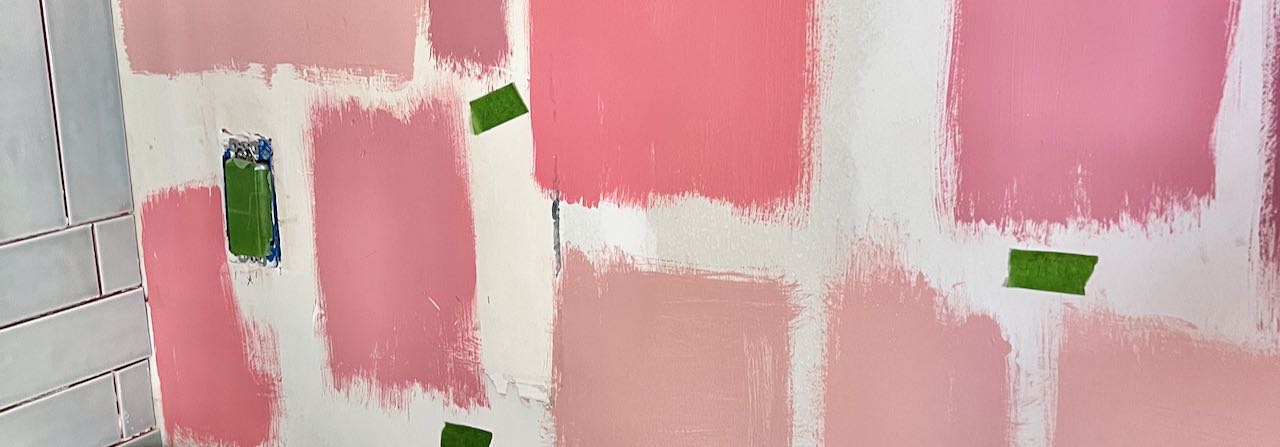
The image size is (1280, 447). Find the location of `horizontal tiles`. horizontal tiles is located at coordinates [x=77, y=285], [x=129, y=271], [x=95, y=325], [x=77, y=408], [x=134, y=403], [x=150, y=441].